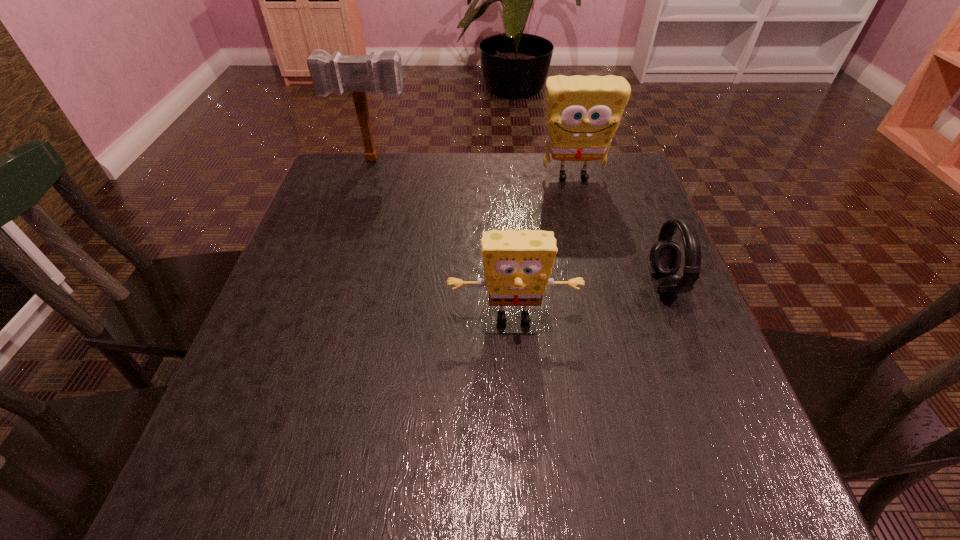
This screenshot has height=540, width=960. I want to click on object situated at the far right corner, so click(583, 113).

This screenshot has height=540, width=960. In the image, there is a desktop. In order to click on vacant space at the far edge in this screenshot , I will do `click(546, 175)`.

Where is `free spot at the left edge of the desktop`? The height and width of the screenshot is (540, 960). free spot at the left edge of the desktop is located at coordinates click(x=269, y=316).

The height and width of the screenshot is (540, 960). What are the coordinates of `blank space at the right edge of the desktop` in the screenshot? It's located at (706, 353).

Locate an element on the screen. The height and width of the screenshot is (540, 960). free space at the far left corner of the desktop is located at coordinates (365, 194).

Where is `vacant space at the near left corner`? vacant space at the near left corner is located at coordinates (271, 456).

Locate an element on the screen. vacant space at the far right corner of the desktop is located at coordinates (590, 190).

This screenshot has height=540, width=960. Find the location of `empty space between the second shortest object and the mallet`. empty space between the second shortest object and the mallet is located at coordinates (444, 239).

This screenshot has width=960, height=540. What are the coordinates of `free area in between the headset and the nearer sponge` in the screenshot? It's located at (589, 300).

The image size is (960, 540). I want to click on vacant space in between the mallet and the rightmost object, so click(519, 221).